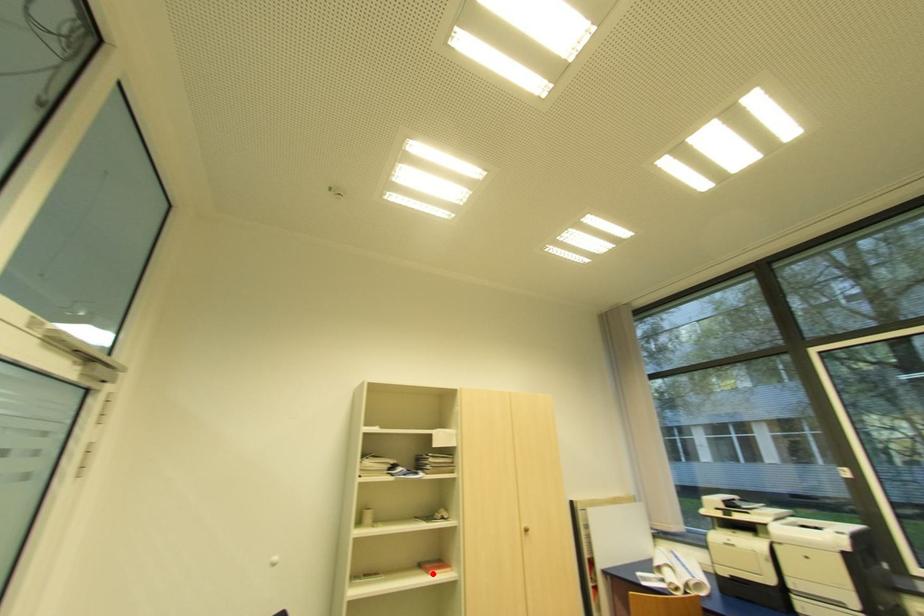
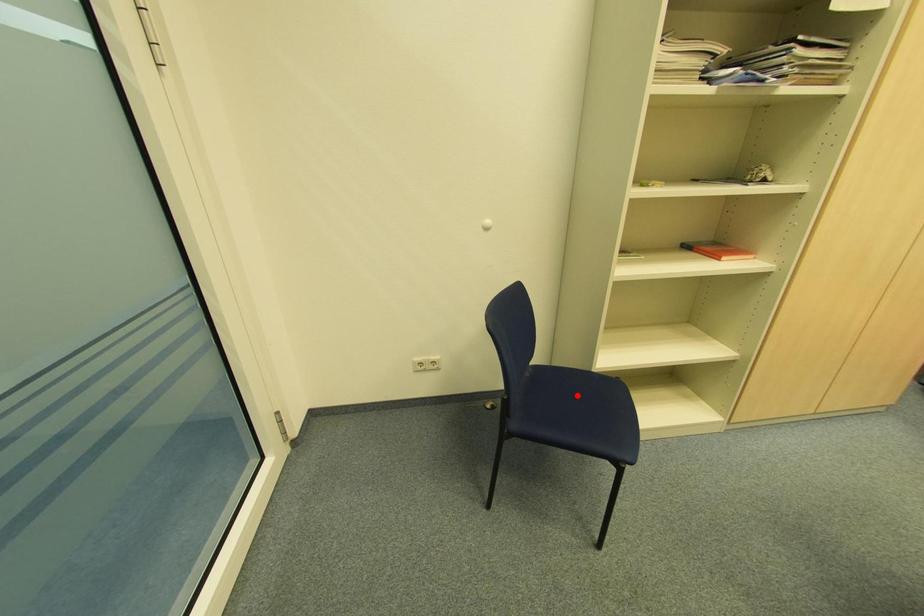
I am providing you with two images of the same scene from different viewpoints. A red point is marked on the first image and another point is marked on the second image. Are the points marked in image1 and image2 representing the same 3D position?

No